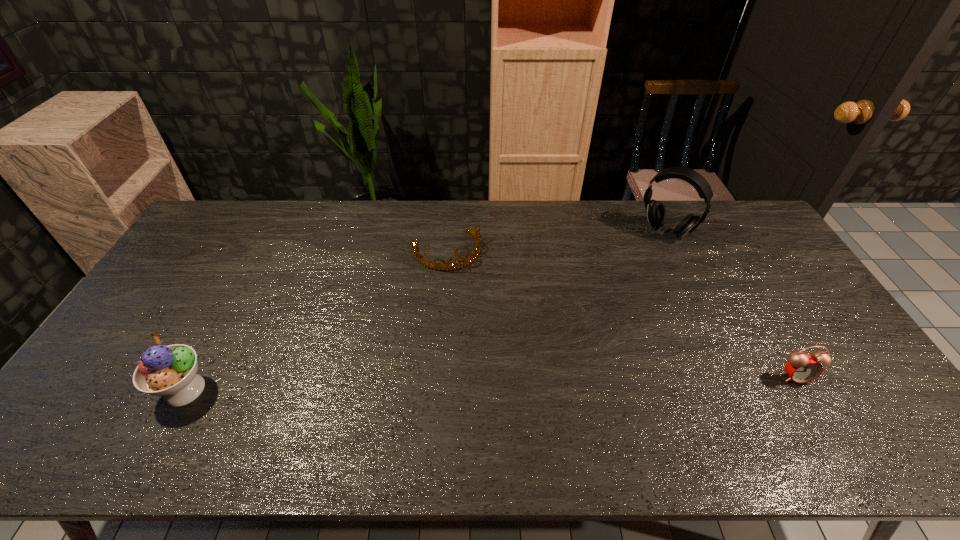
Where is `free spot located 0.370m on the front-facing side of the shortest object`? The height and width of the screenshot is (540, 960). free spot located 0.370m on the front-facing side of the shortest object is located at coordinates click(x=495, y=363).

Locate an element on the screen. vacant space positioned on the front-facing side of the shortest object is located at coordinates (477, 319).

The width and height of the screenshot is (960, 540). What are the coordinates of `vacant point located 0.160m on the front-facing side of the shortest object` in the screenshot? It's located at (471, 307).

Find the location of a particular element. The height and width of the screenshot is (540, 960). vacant space located on the ear cups of the second object from right to left is located at coordinates (633, 269).

At what (x,y) coordinates should I click in order to perform the action: click on vacant space located on the ear cups of the second object from right to left. Please return your answer as a coordinate pair (x, y). This screenshot has width=960, height=540. Looking at the image, I should click on (632, 271).

The height and width of the screenshot is (540, 960). Find the location of `vacant space located 0.230m on the ear cups of the second object from right to left`. vacant space located 0.230m on the ear cups of the second object from right to left is located at coordinates (624, 280).

Identify the location of tiara that is at the far edge. pos(433,265).

The height and width of the screenshot is (540, 960). What are the coordinates of `earphone at the far edge` in the screenshot? It's located at (656, 212).

Identify the location of icecream at the near edge. (170, 371).

Where is `alarm clock present at the near edge`? This screenshot has height=540, width=960. alarm clock present at the near edge is located at coordinates (802, 368).